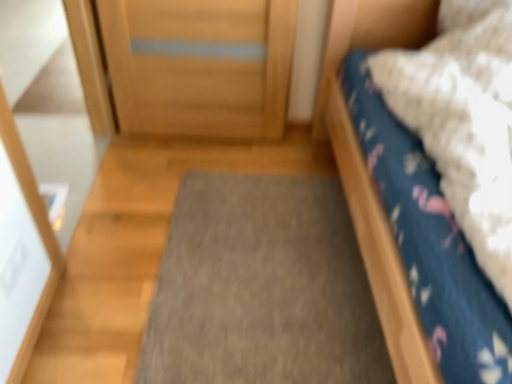
Question: From a real-world perspective, is gray carpet at center above or below blue cotton bed at right?

Choices:
 (A) below
 (B) above

Answer: (A)

Question: Which is correct: gray carpet at center is inside blue cotton bed at right, or outside of it?

Choices:
 (A) outside
 (B) inside

Answer: (A)

Question: Considering the positions of point (297, 370) and point (322, 97), is point (297, 370) closer or farther from the camera than point (322, 97)?

Choices:
 (A) farther
 (B) closer

Answer: (B)

Question: Looking at their shapes, would you say blue cotton bed at right is wider or thinner than gray carpet at center?

Choices:
 (A) thin
 (B) wide

Answer: (B)

Question: From the image's perspective, is blue cotton bed at right above or below gray carpet at center?

Choices:
 (A) below
 (B) above

Answer: (B)

Question: Based on their sizes in the image, would you say blue cotton bed at right is bigger or smaller than gray carpet at center?

Choices:
 (A) small
 (B) big

Answer: (B)

Question: Is blue cotton bed at right taller or shorter than gray carpet at center?

Choices:
 (A) tall
 (B) short

Answer: (A)